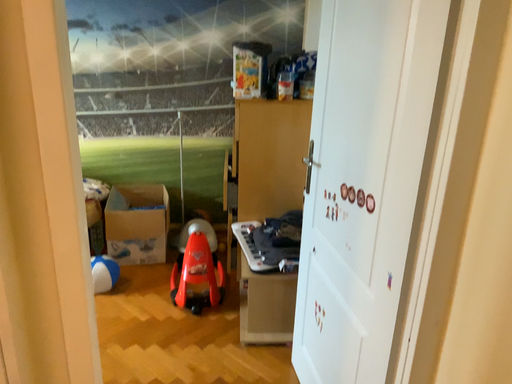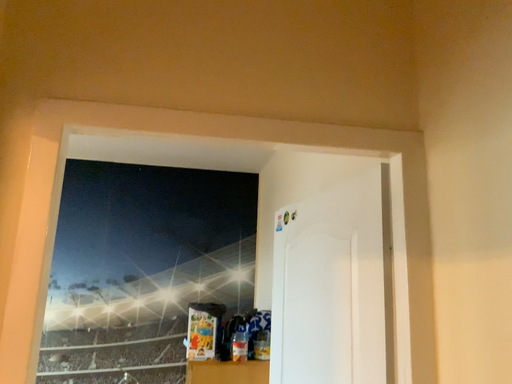
Question: Which way did the camera rotate in the video?

Choices:
 (A) rotated right
 (B) rotated left

Answer: (A)